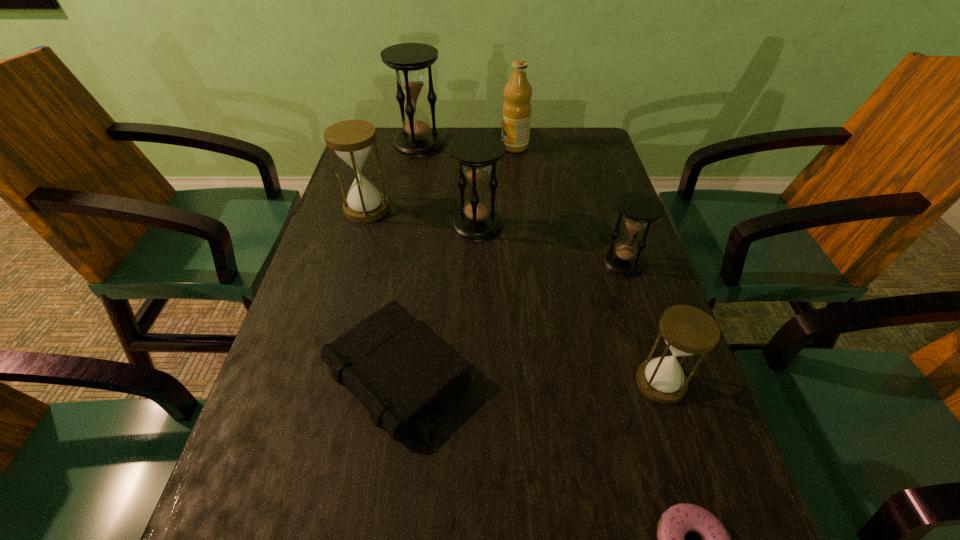
What are the coordinates of `hourglass that is the third closest one to the nearer white hourglass` in the screenshot? It's located at (351, 140).

What are the coordinates of `black hourglass that is the second nearest to the Bible` in the screenshot? It's located at (639, 209).

Where is `black hourglass that is the nearest to the fifth farthest object`? This screenshot has height=540, width=960. black hourglass that is the nearest to the fifth farthest object is located at coordinates (477, 153).

Where is `vacant position in the image that satisfies the following two spatial constraints: 1. on the label of the smallest black hourglass; 2. on the left side of the fifth object from left to right`? This screenshot has height=540, width=960. vacant position in the image that satisfies the following two spatial constraints: 1. on the label of the smallest black hourglass; 2. on the left side of the fifth object from left to right is located at coordinates (527, 263).